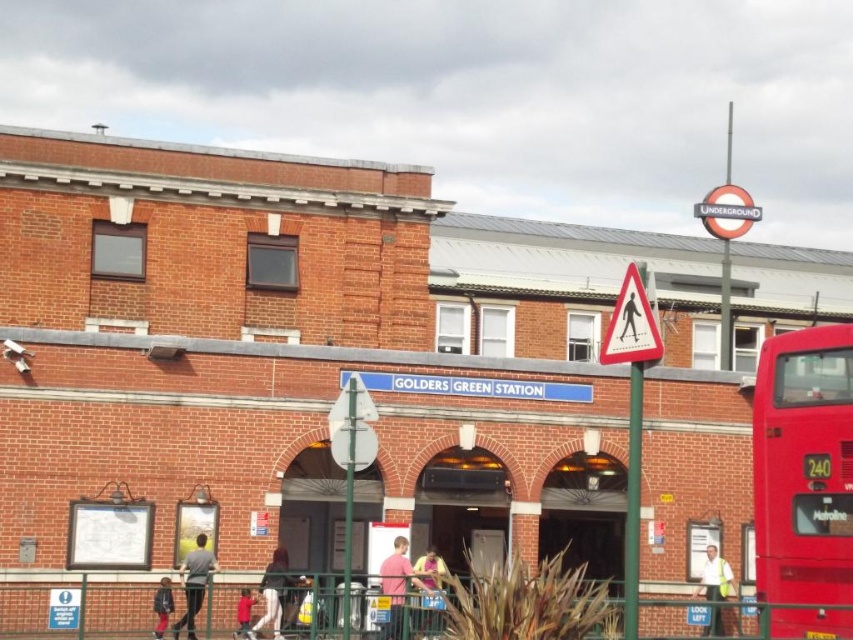
Question: Is pink matte shirt at center to the left of matte black backpack at lower left from the viewer's perspective?

Choices:
 (A) yes
 (B) no

Answer: (B)

Question: Which of these objects is positioned farthest from the pink fabric shirt at center?

Choices:
 (A) red metallic bus at right
 (B) white shirt at center
 (C) red matte shirt at lower center

Answer: (B)

Question: Which object appears farthest from the camera in this image?

Choices:
 (A) matte black backpack at lower left
 (B) pink matte shirt at center
 (C) pink fabric shirt at center
 (D) red metallic bus at right

Answer: (B)

Question: Does pink matte shirt at center appear over dark gray fabric jacket at center?

Choices:
 (A) no
 (B) yes

Answer: (B)

Question: Estimate the real-world distances between objects in this image. Which object is farther from the gray fabric jacket at lower left?

Choices:
 (A) matte black backpack at lower left
 (B) pink matte shirt at center
 (C) pink fabric shirt at center

Answer: (C)

Question: Can you confirm if pink matte shirt at center is wider than red matte shirt at lower center?

Choices:
 (A) no
 (B) yes

Answer: (A)